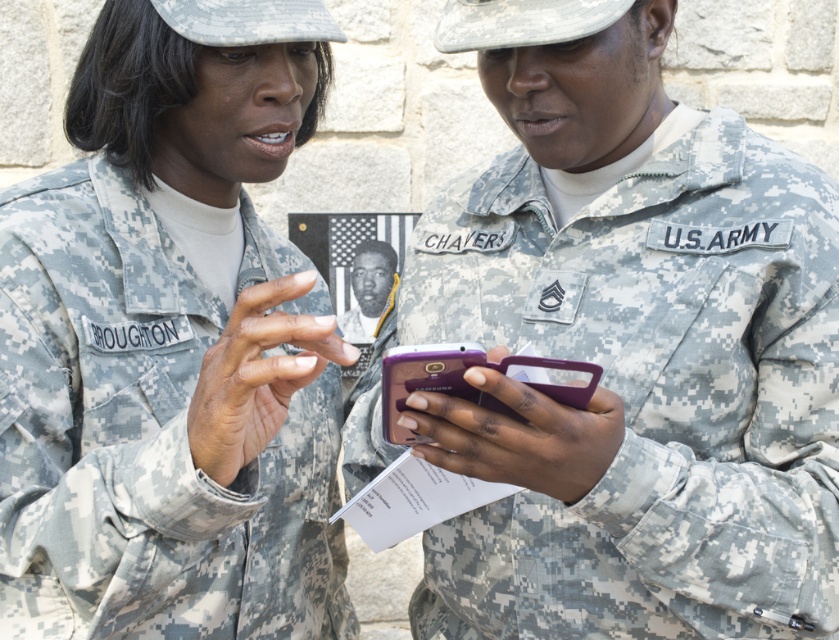
You are a soldier standing 2 meters away from the point at coordinates point (x=725, y=129). Can you reach that point without moving your feet?

The distance of point (x=725, y=129) from viewer is 1.83 meters. Since you are standing 2 meters away from the point, you cannot reach it without moving your feet because the distance is greater than your current position.

You are a tailor who needs to determine which uniform to alter for a soldier. The camouflage uniform at center and the camouflage fabric us army uniform at center are both options. Which one is more suitable for alterations if you need to work with a thinner material?

The camouflage uniform at center is thinner than the camouflage fabric us army uniform at center, so it is more suitable for alterations requiring a thinner material.

You are a tailor who needs to determine which uniform requires more fabric to make between the camouflage uniform at center and the camouflage fabric us army uniform at center. Based on the description, which one would need more fabric?

The camouflage uniform at center requires more fabric to make because it is larger in size than the camouflage fabric us army uniform at center.